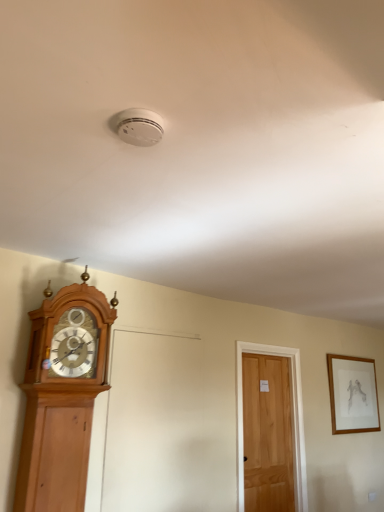
Question: From the image's perspective, is light brown wooden door at center-right below light brown wooden clock at left?

Choices:
 (A) no
 (B) yes

Answer: (B)

Question: Is light brown wooden door at center-right in front of light brown wooden clock at left?

Choices:
 (A) no
 (B) yes

Answer: (A)

Question: From a real-world perspective, is light brown wooden door at center-right physically below light brown wooden clock at left?

Choices:
 (A) no
 (B) yes

Answer: (B)

Question: Considering the relative positions of light brown wooden door at center-right and light brown wooden clock at left in the image provided, is light brown wooden door at center-right behind light brown wooden clock at left?

Choices:
 (A) yes
 (B) no

Answer: (A)

Question: Is light brown wooden door at center-right shorter than light brown wooden clock at left?

Choices:
 (A) yes
 (B) no

Answer: (A)

Question: Considering the positions of wooden framed drawing at upper right and light brown wooden door at center-right in the image, is wooden framed drawing at upper right wider or thinner than light brown wooden door at center-right?

Choices:
 (A) wide
 (B) thin

Answer: (B)

Question: Considering the positions of wooden framed drawing at upper right and light brown wooden door at center-right in the image, is wooden framed drawing at upper right bigger or smaller than light brown wooden door at center-right?

Choices:
 (A) small
 (B) big

Answer: (A)

Question: In the image, is wooden framed drawing at upper right on the left side or the right side of light brown wooden door at center-right?

Choices:
 (A) left
 (B) right

Answer: (B)

Question: Is wooden framed drawing at upper right spatially inside light brown wooden door at center-right, or outside of it?

Choices:
 (A) outside
 (B) inside

Answer: (A)

Question: Looking at their shapes, would you say light brown wooden door at center-right is wider or thinner than wooden framed drawing at upper right?

Choices:
 (A) thin
 (B) wide

Answer: (B)

Question: In terms of height, does light brown wooden door at center-right look taller or shorter compared to wooden framed drawing at upper right?

Choices:
 (A) tall
 (B) short

Answer: (A)

Question: Relative to wooden framed drawing at upper right, is light brown wooden door at center-right in front or behind?

Choices:
 (A) front
 (B) behind

Answer: (A)

Question: From the image's perspective, relative to wooden framed drawing at upper right, is light brown wooden door at center-right above or below?

Choices:
 (A) above
 (B) below

Answer: (B)

Question: Is light brown wooden door at center-right inside or outside of light brown wooden clock at left?

Choices:
 (A) outside
 (B) inside

Answer: (A)

Question: Based on their sizes in the image, would you say light brown wooden door at center-right is bigger or smaller than light brown wooden clock at left?

Choices:
 (A) small
 (B) big

Answer: (A)